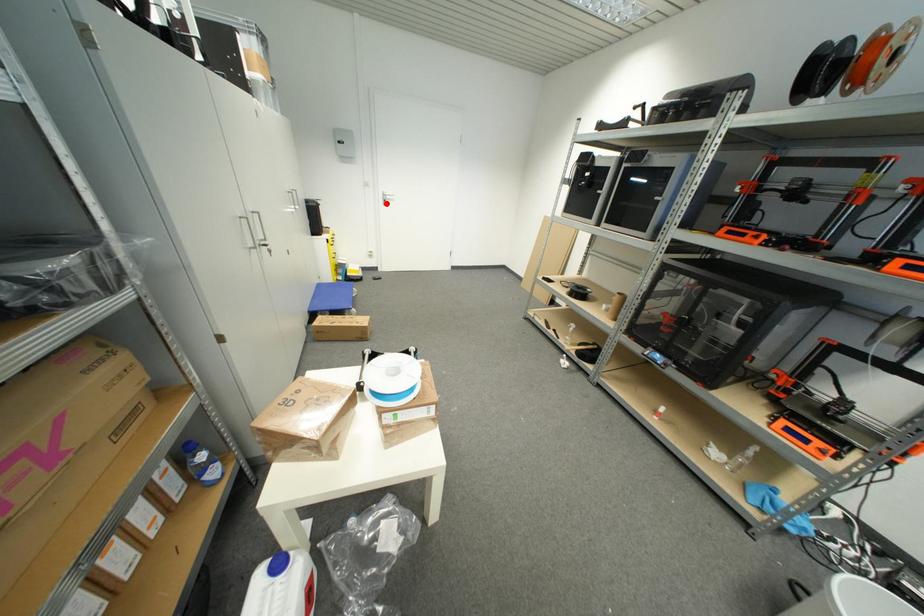
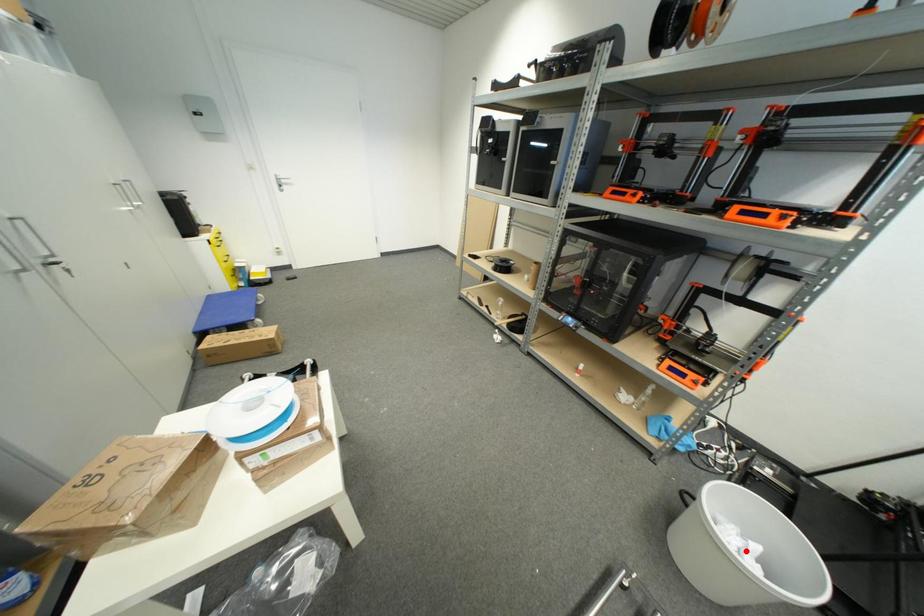
I am providing you with two images of the same scene from different viewpoints. A red point is marked on the first image and another point is marked on the second image. Do the highlighted points in image1 and image2 indicate the same real-world spot?

No